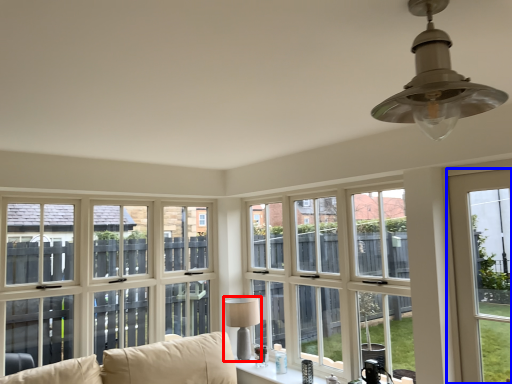
Question: Which object is closer to the camera taking this photo, lamp (highlighted by a red box) or window (highlighted by a blue box)?

Choices:
 (A) lamp
 (B) window

Answer: (B)